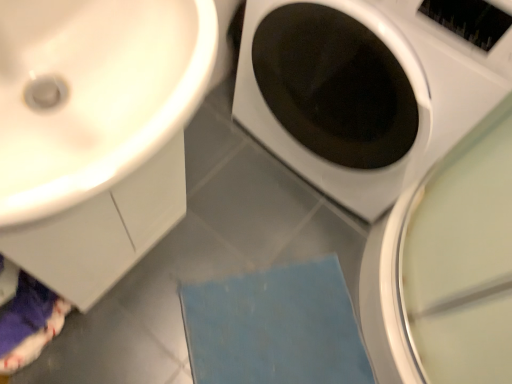
Question: Considering the relative sizes of blue fabric bath mat at lower center and white glossy sink at upper left in the image provided, is blue fabric bath mat at lower center bigger than white glossy sink at upper left?

Choices:
 (A) no
 (B) yes

Answer: (A)

Question: Is blue fabric bath mat at lower center in front of white glossy sink at upper left?

Choices:
 (A) no
 (B) yes

Answer: (A)

Question: From the image's perspective, would you say blue fabric bath mat at lower center is shown under white glossy sink at upper left?

Choices:
 (A) no
 (B) yes

Answer: (B)

Question: Does blue fabric bath mat at lower center come behind white glossy sink at upper left?

Choices:
 (A) no
 (B) yes

Answer: (B)

Question: Would you say blue fabric bath mat at lower center is outside white glossy sink at upper left?

Choices:
 (A) yes
 (B) no

Answer: (A)

Question: Is point (14, 183) closer or farther from the camera than point (332, 99)?

Choices:
 (A) farther
 (B) closer

Answer: (B)

Question: Is white glossy sink at upper left spatially inside white glossy washing machine at center, or outside of it?

Choices:
 (A) inside
 (B) outside

Answer: (B)

Question: From the image's perspective, relative to white glossy washing machine at center, is white glossy sink at upper left above or below?

Choices:
 (A) above
 (B) below

Answer: (B)

Question: Is white glossy sink at upper left taller or shorter than white glossy washing machine at center?

Choices:
 (A) short
 (B) tall

Answer: (A)

Question: Looking at their shapes, would you say blue fabric bath mat at lower center is wider or thinner than white glossy sink at upper left?

Choices:
 (A) wide
 (B) thin

Answer: (A)

Question: Considering the positions of blue fabric bath mat at lower center and white glossy sink at upper left in the image, is blue fabric bath mat at lower center bigger or smaller than white glossy sink at upper left?

Choices:
 (A) small
 (B) big

Answer: (A)

Question: Is point (211, 377) closer or farther from the camera than point (6, 96)?

Choices:
 (A) farther
 (B) closer

Answer: (A)

Question: Considering their positions, is blue fabric bath mat at lower center located in front of or behind white glossy sink at upper left?

Choices:
 (A) behind
 (B) front

Answer: (A)

Question: Is white glossy washing machine at center inside or outside of blue fabric bath mat at lower center?

Choices:
 (A) inside
 (B) outside

Answer: (B)

Question: From the image's perspective, is white glossy washing machine at center located above or below blue fabric bath mat at lower center?

Choices:
 (A) above
 (B) below

Answer: (A)